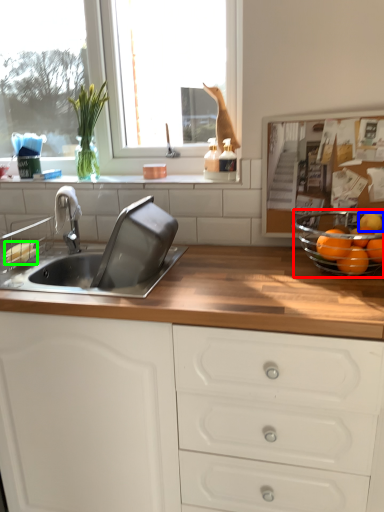
Question: Based on their relative distances, which object is farther from glass bowl (highlighted by a red box)? Choose from orange (highlighted by a blue box) and food (highlighted by a green box).

Choices:
 (A) orange
 (B) food

Answer: (B)